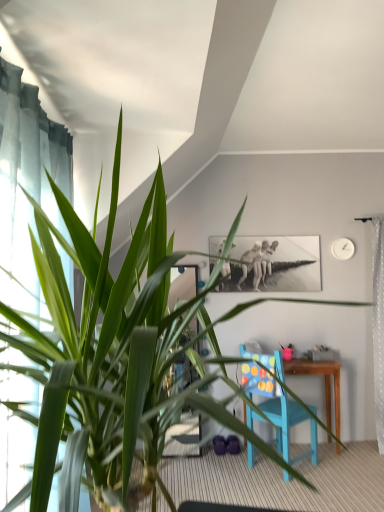
The image size is (384, 512). I want to click on free space in front of matte blue chair at center, so click(289, 488).